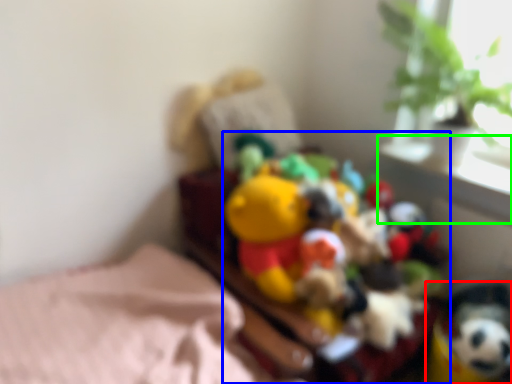
Question: Which object is the farthest from toy (highlighted by a red box)? Choose among these: toy (highlighted by a blue box) or window sill (highlighted by a green box).

Choices:
 (A) toy
 (B) window sill

Answer: (B)